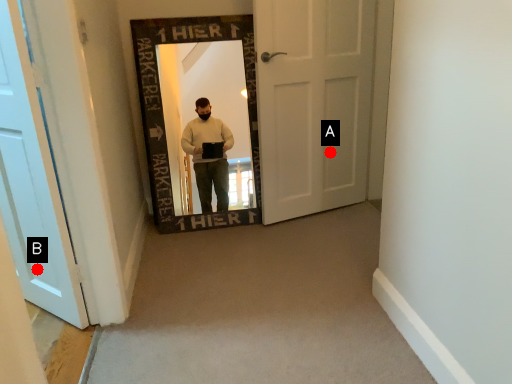
Question: Two points are circled on the image, labeled by A and B beside each circle. Which point appears farthest from the camera in this image?

Choices:
 (A) A is further
 (B) B is further

Answer: (A)